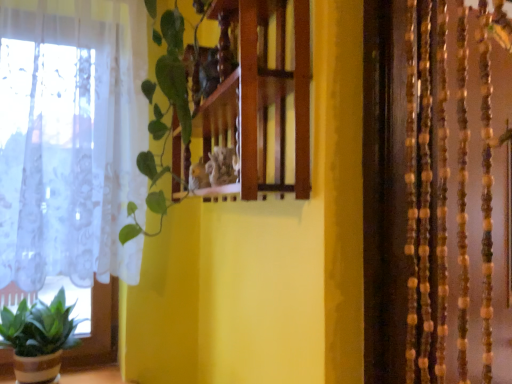
Question: Should I look upward or downward to see green leafy plant at center?

Choices:
 (A) down
 (B) up

Answer: (B)

Question: Does green leafy plant at center lie in front of green matte plant at lower left?

Choices:
 (A) no
 (B) yes

Answer: (B)

Question: Is green matte plant at lower left located within green leafy plant at center?

Choices:
 (A) no
 (B) yes

Answer: (A)

Question: Considering the relative sizes of green leafy plant at center and green matte plant at lower left in the image provided, is green leafy plant at center bigger than green matte plant at lower left?

Choices:
 (A) no
 (B) yes

Answer: (B)

Question: Considering the relative sizes of green leafy plant at center and green matte plant at lower left in the image provided, is green leafy plant at center smaller than green matte plant at lower left?

Choices:
 (A) yes
 (B) no

Answer: (B)

Question: From the image's perspective, would you say green leafy plant at center is positioned over green matte plant at lower left?

Choices:
 (A) yes
 (B) no

Answer: (A)

Question: Is the depth of green leafy plant at center greater than that of green matte plant at lower left?

Choices:
 (A) yes
 (B) no

Answer: (B)

Question: Is wooden shelf at center turned away from green matte plant at lower left?

Choices:
 (A) no
 (B) yes

Answer: (A)

Question: Can you confirm if wooden shelf at center is positioned to the left of green matte plant at lower left?

Choices:
 (A) no
 (B) yes

Answer: (A)

Question: Is wooden shelf at center wider than green matte plant at lower left?

Choices:
 (A) no
 (B) yes

Answer: (A)

Question: From a real-world perspective, is wooden shelf at center located beneath green matte plant at lower left?

Choices:
 (A) yes
 (B) no

Answer: (B)

Question: From the image's perspective, is wooden shelf at center on top of green matte plant at lower left?

Choices:
 (A) yes
 (B) no

Answer: (A)

Question: Does wooden shelf at center turn towards green matte plant at lower left?

Choices:
 (A) no
 (B) yes

Answer: (A)

Question: Considering the relative sizes of green leafy plant at center and wooden shelf at center in the image provided, is green leafy plant at center smaller than wooden shelf at center?

Choices:
 (A) yes
 (B) no

Answer: (A)